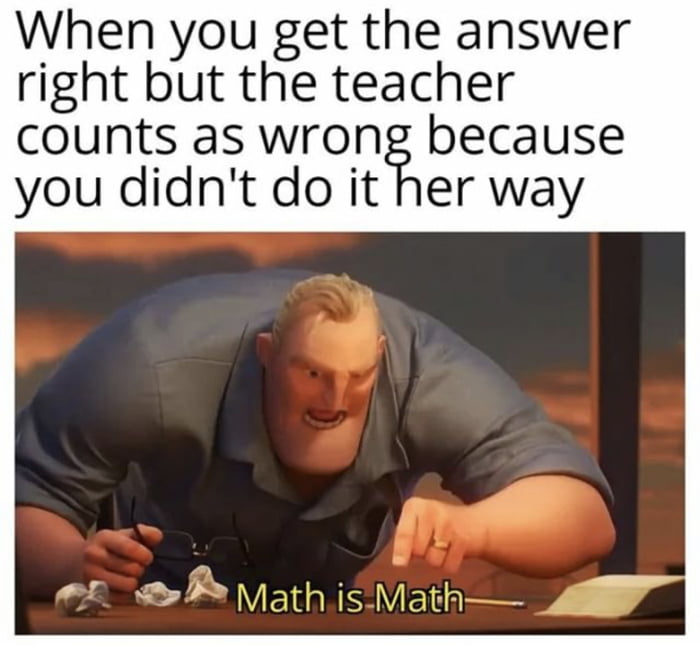
At what (x,y) coordinates should I click in order to perform the action: click on desk. Please return your answer as a coordinate pair (x, y). The width and height of the screenshot is (700, 645). Looking at the image, I should click on (475, 616).